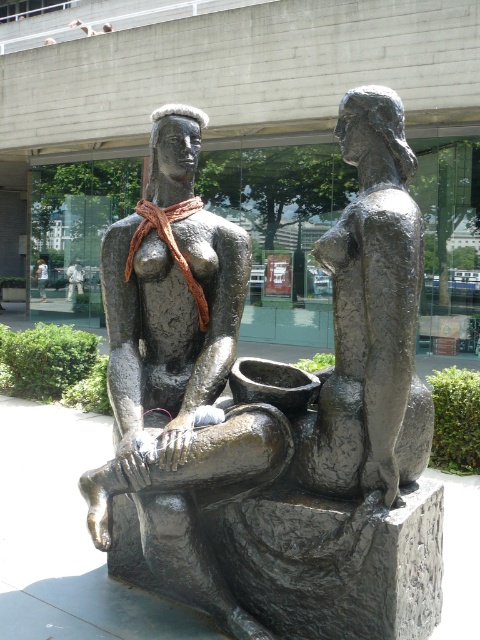
Question: Does bronze statue at center lie in front of matte bronze statue at center?

Choices:
 (A) yes
 (B) no

Answer: (A)

Question: Does bronze statue at center lie in front of matte bronze statue at center?

Choices:
 (A) yes
 (B) no

Answer: (A)

Question: Among these points, which one is farthest from the camera?

Choices:
 (A) (388, 634)
 (B) (45, 266)

Answer: (B)

Question: Which object is closer to the camera taking this photo?

Choices:
 (A) matte bronze statue at center
 (B) bronze statue at center

Answer: (B)

Question: Can you confirm if bronze statue at center is positioned above matte bronze statue at center?

Choices:
 (A) yes
 (B) no

Answer: (B)